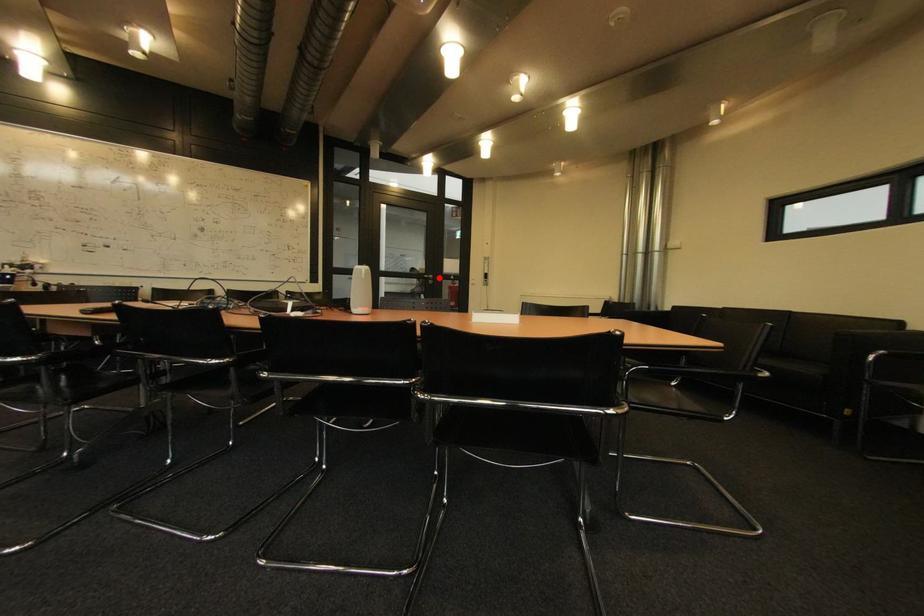
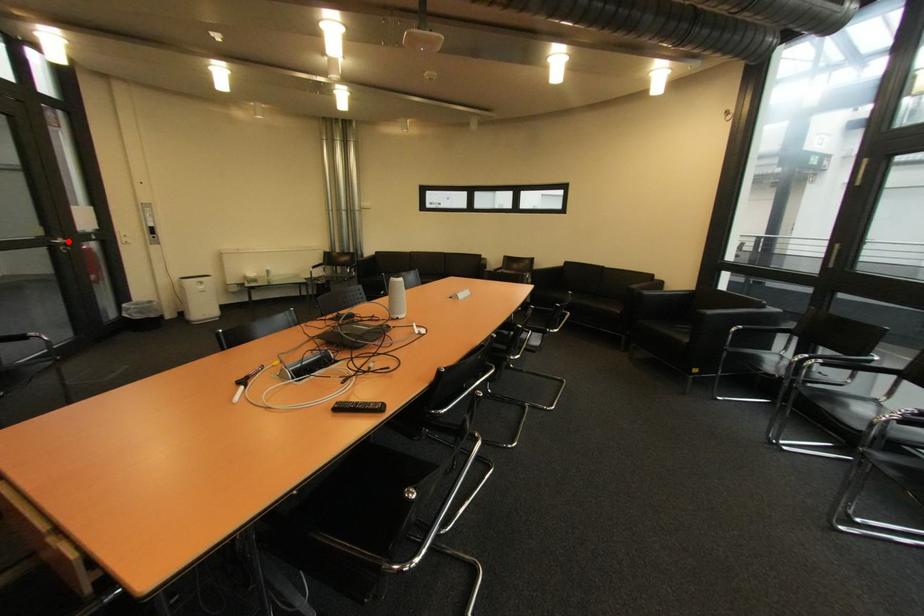
I am providing you with two images of the same scene from different viewpoints. A red point is marked on the first image and another point is marked on the second image. Do the highlighted points in image1 and image2 indicate the same real-world spot?

Yes